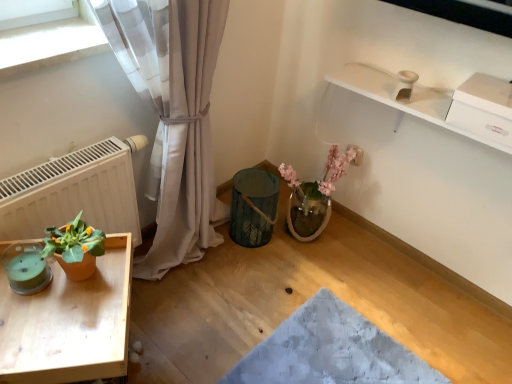
At what (x,y) coordinates should I click in order to perform the action: click on free space on the front side of terracotta pot at left. Please return your answer as a coordinate pair (x, y). The height and width of the screenshot is (384, 512). Looking at the image, I should click on (58, 328).